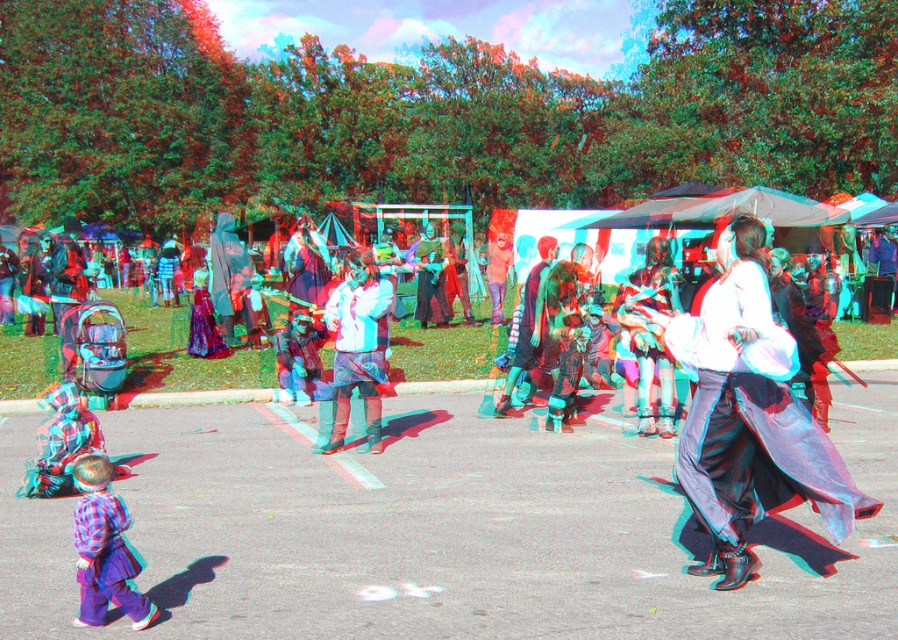
Question: Can you confirm if silky black dress at center is positioned to the left of plaid fabric shirt at lower left?

Choices:
 (A) no
 (B) yes

Answer: (A)

Question: Among these objects, which one is nearest to the camera?

Choices:
 (A) plaid fabric shirt at lower left
 (B) white matte jacket at center

Answer: (A)

Question: Is silky black dress at center further to camera compared to plaid fabric shirt at lower left?

Choices:
 (A) no
 (B) yes

Answer: (B)

Question: Among these objects, which one is farthest from the camera?

Choices:
 (A) plaid fabric shirt at lower left
 (B) silky black dress at center

Answer: (B)

Question: Which object is the closest to the white matte jacket at center?

Choices:
 (A) plaid fabric shirt at lower left
 (B) silky black dress at center

Answer: (B)

Question: Does white matte jacket at center appear under plaid fabric shirt at lower left?

Choices:
 (A) no
 (B) yes

Answer: (A)